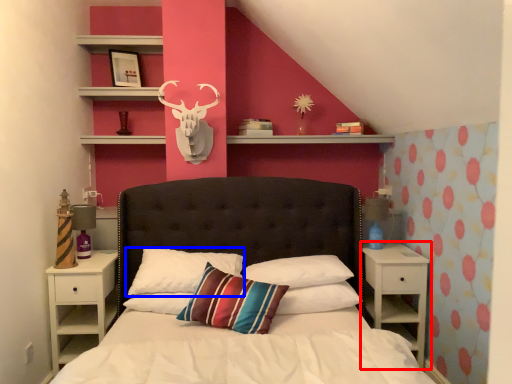
Question: Which of the following is the closest to the observer, nightstand (highlighted by a red box) or pillow (highlighted by a blue box)?

Choices:
 (A) nightstand
 (B) pillow

Answer: (B)